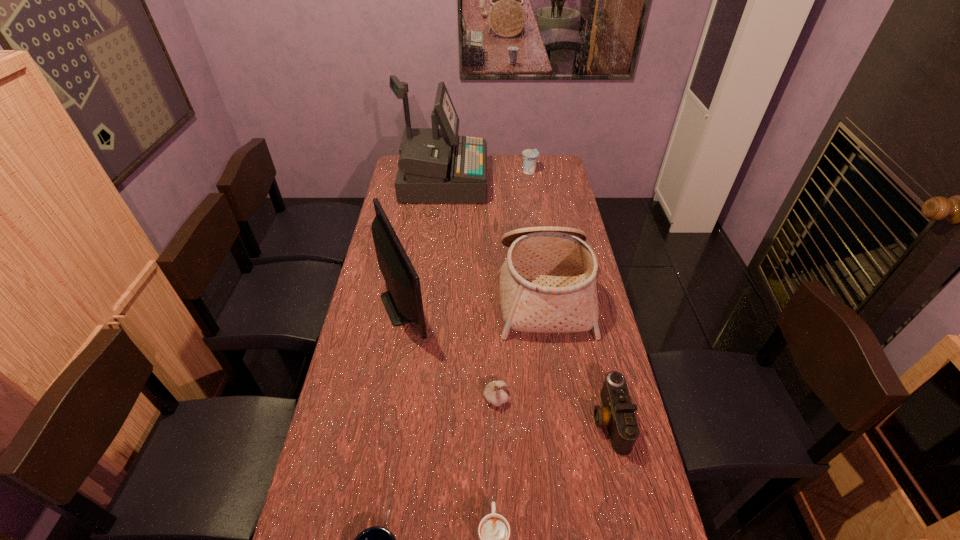
Image resolution: width=960 pixels, height=540 pixels. What are the coordinates of `unoccupied position between the basket and the garlic` in the screenshot? It's located at (519, 345).

Image resolution: width=960 pixels, height=540 pixels. I want to click on free space between the basket and the computer monitor, so click(x=474, y=298).

You are a GUI agent. You are given a task and a screenshot of the screen. Output one action in this format:
    pyautogui.click(x=<x>, y=<y>)
    Task: Click on the free space between the computer monitor and the sixth shortest object
    The width and height of the screenshot is (960, 540).
    Given the screenshot: What is the action you would take?
    pyautogui.click(x=474, y=298)

Find the location of a particular element. the closest object to the camera is located at coordinates (547, 284).

Point out which object is positioned as the sixth nearest to the sixth shortest object. Please provide its 2D coordinates. Your answer should be formatted as a tuple, i.e. [(x, y)], where the tuple contains the x and y coordinates of a point satisfying the conditions above.

[(530, 156)]

Identify the location of free spot that satisfies the following two spatial constraints: 1. on the customer-facing side of the cash register; 2. on the right side of the garlic. (418, 398).